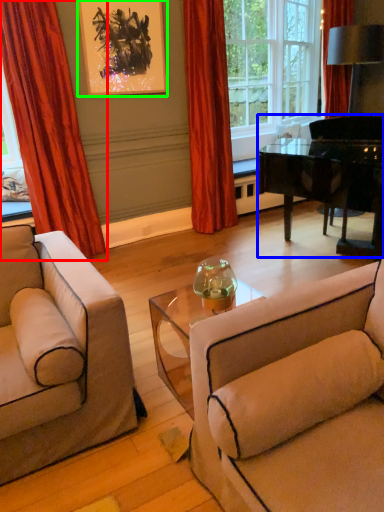
Question: Which is nearer to the curtain (highlighted by a red box)? piano (highlighted by a blue box) or picture frame (highlighted by a green box).

Choices:
 (A) piano
 (B) picture frame

Answer: (B)